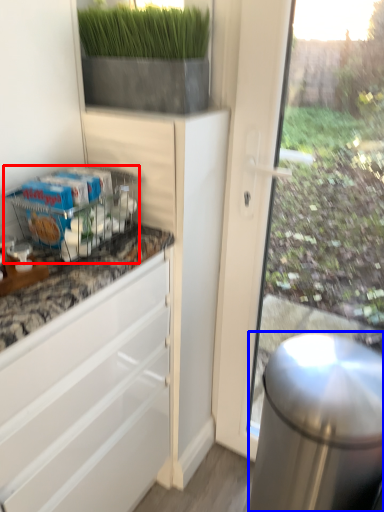
Question: Which point is further to the camera, shelf (highlighted by a red box) or appliance (highlighted by a blue box)?

Choices:
 (A) shelf
 (B) appliance

Answer: (A)